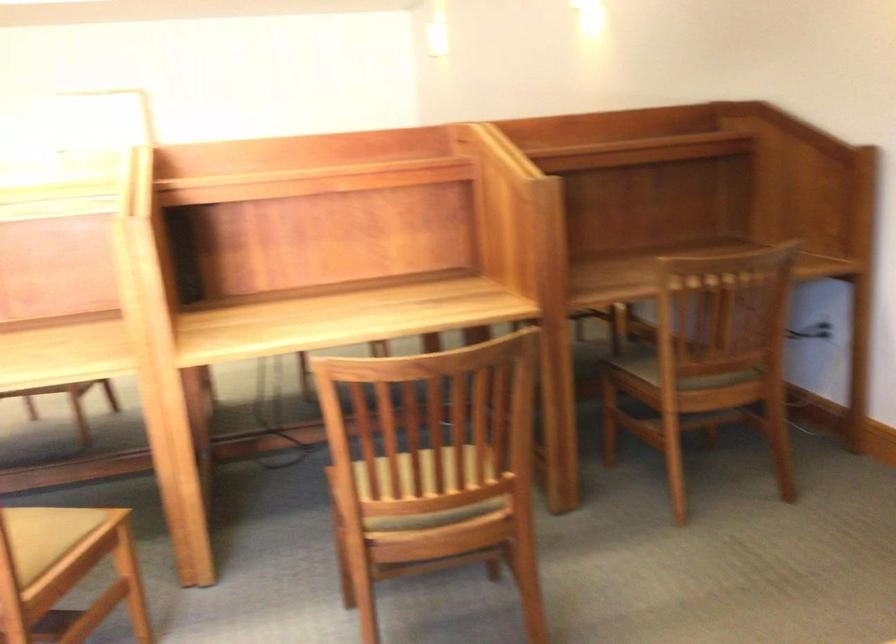
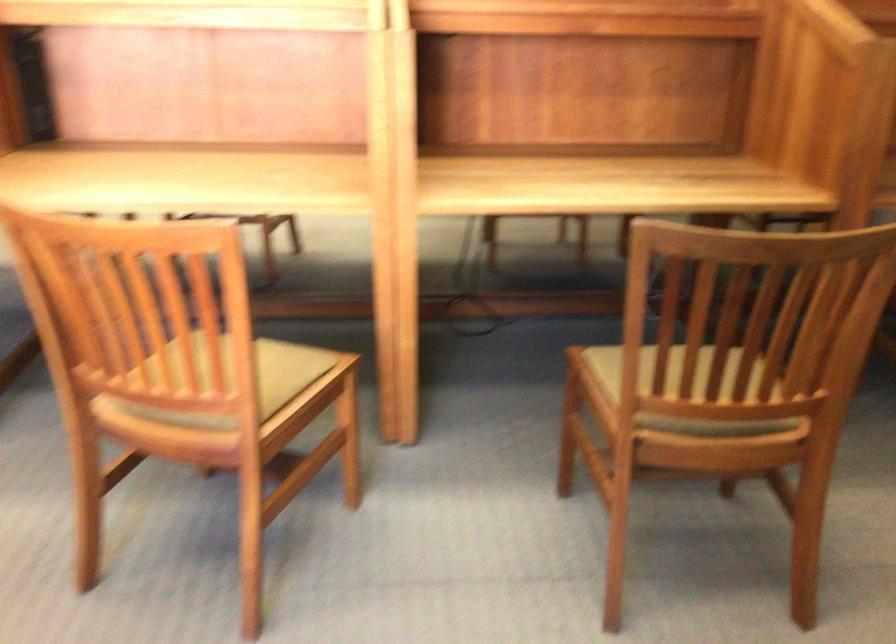
Which direction would the cameraman need to move to produce the second image?

The cameraman walked toward left, forward.